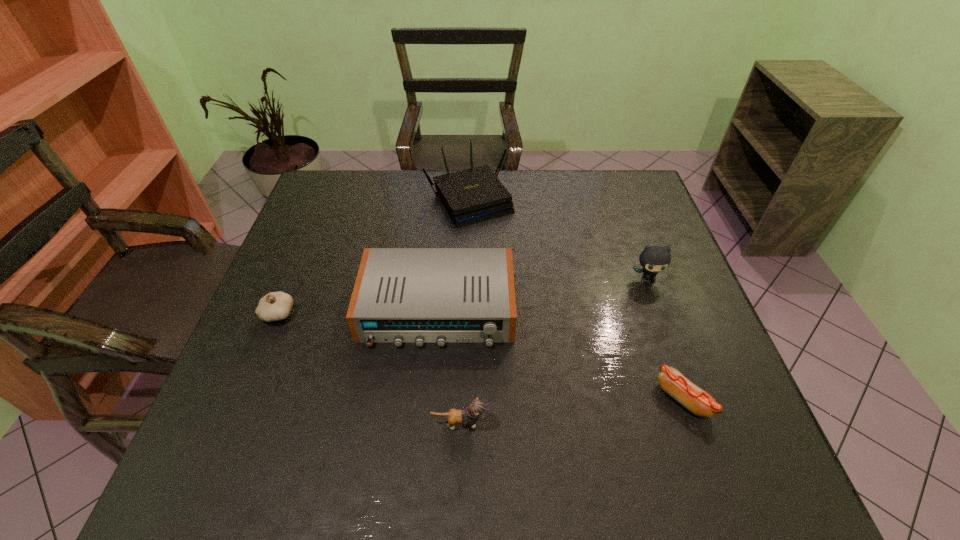
Find the location of a particular element. vacant area situated 0.300m on the front panel of the radio receiver is located at coordinates (421, 491).

You are a GUI agent. You are given a task and a screenshot of the screen. Output one action in this format:
    pyautogui.click(x=<x>, y=<y>)
    Task: Click on the vacant area situated on the front-facing side of the shorter kitten
    The image size is (960, 540).
    Given the screenshot: What is the action you would take?
    pyautogui.click(x=607, y=423)

Identify the location of free region located on the front of the leftmost object. This screenshot has height=540, width=960. (230, 430).

Locate an element on the screen. The width and height of the screenshot is (960, 540). vacant space located 0.070m on the right of the shortest object is located at coordinates (740, 399).

At what (x,y) coordinates should I click in order to perform the action: click on object present at the far edge. Please return your answer as a coordinate pair (x, y). This screenshot has height=540, width=960. Looking at the image, I should click on (471, 196).

Locate an element on the screen. This screenshot has width=960, height=540. object located at the left edge is located at coordinates (275, 306).

The width and height of the screenshot is (960, 540). In order to click on kitten positioned at the right edge in this screenshot , I will do `click(654, 259)`.

At what (x,y) coordinates should I click in order to perform the action: click on sausage that is at the right edge. Please return your answer as a coordinate pair (x, y). The image size is (960, 540). Looking at the image, I should click on (699, 402).

Find the location of a particular element. This screenshot has height=540, width=960. free space at the far edge of the desktop is located at coordinates (378, 171).

What are the coordinates of `free region at the near edge of the desktop` in the screenshot? It's located at (571, 475).